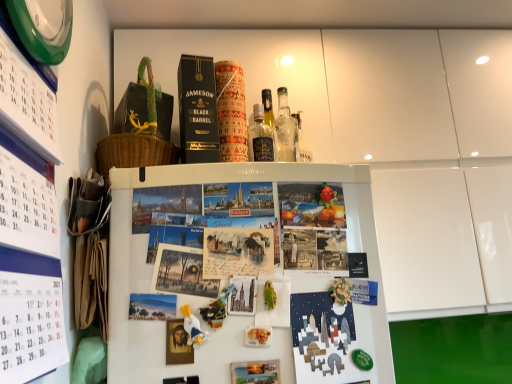
Question: From a real-world perspective, does white matte refrigerator at center sit lower than vintage paper postcard at center, marked as the 2th book cover in a bottom-to-top arrangement?

Choices:
 (A) no
 (B) yes

Answer: (B)

Question: Is white matte refrigerator at center positioned behind vintage paper postcard at center, which ranks as the first book cover in top-to-bottom order?

Choices:
 (A) yes
 (B) no

Answer: (B)

Question: From a real-world perspective, is white matte refrigerator at center over vintage paper postcard at center, which ranks as the first book cover in top-to-bottom order?

Choices:
 (A) no
 (B) yes

Answer: (A)

Question: Is white matte refrigerator at center not inside vintage paper postcard at center, which ranks as the first book cover in top-to-bottom order?

Choices:
 (A) yes
 (B) no

Answer: (A)

Question: Is white matte refrigerator at center wider than vintage paper postcard at center, which is the second book cover in right-to-left order?

Choices:
 (A) no
 (B) yes

Answer: (B)

Question: Is white matte refrigerator at center to the right of vintage paper postcard at center, which ranks as the first book cover in top-to-bottom order, from the viewer's perspective?

Choices:
 (A) yes
 (B) no

Answer: (A)

Question: Does green plastic clock at upper left have a greater height compared to vintage paper postcard at center, which ranks as the first book cover in top-to-bottom order?

Choices:
 (A) yes
 (B) no

Answer: (A)

Question: Is vintage paper postcard at center, marked as the 2th book cover in a bottom-to-top arrangement, at the back of green plastic clock at upper left?

Choices:
 (A) yes
 (B) no

Answer: (B)

Question: Can we say green plastic clock at upper left lies outside vintage paper postcard at center, which is the second book cover in right-to-left order?

Choices:
 (A) no
 (B) yes

Answer: (B)

Question: Is the surface of green plastic clock at upper left in direct contact with vintage paper postcard at center, which is the second book cover in right-to-left order?

Choices:
 (A) yes
 (B) no

Answer: (B)

Question: Is green plastic clock at upper left not close to vintage paper postcard at center, which ranks as the 1th book cover in left-to-right order?

Choices:
 (A) yes
 (B) no

Answer: (B)

Question: Is green plastic clock at upper left thinner than vintage paper postcard at center, which ranks as the 1th book cover in left-to-right order?

Choices:
 (A) yes
 (B) no

Answer: (A)

Question: From the image's perspective, does matte paper postcard at upper center appear higher than green plastic clock at upper left?

Choices:
 (A) no
 (B) yes

Answer: (A)